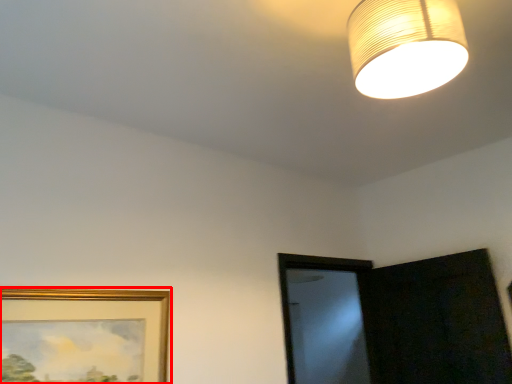
Question: From the image's perspective, where is picture frame (annotated by the red box) located relative to lamp?

Choices:
 (A) below
 (B) above

Answer: (A)